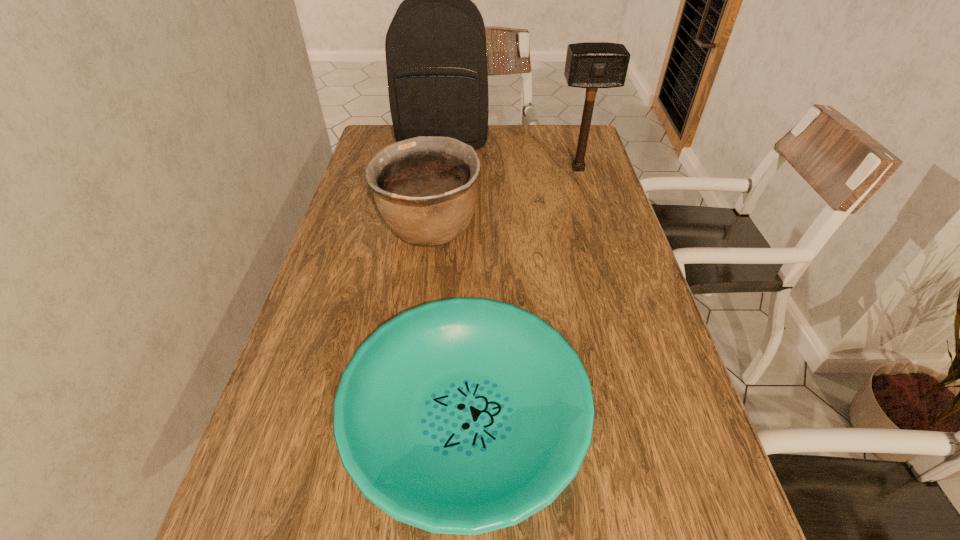
Where is `vacant space that is in between the rightmost object and the second shortest object`? vacant space that is in between the rightmost object and the second shortest object is located at coordinates 504,199.

Locate an element on the screen. This screenshot has width=960, height=540. empty space between the rightmost object and the second nearest object is located at coordinates (504, 199).

Identify the location of object that is the third closest to the second shortest object. (591, 65).

Identify which object is located as the third nearest to the second shortest object. Please provide its 2D coordinates. Your answer should be formatted as a tuple, i.e. [(x, y)], where the tuple contains the x and y coordinates of a point satisfying the conditions above.

[(591, 65)]

I want to click on free spot that satisfies the following two spatial constraints: 1. on the front-facing side of the farthest object; 2. on the right side of the second farthest object, so click(x=441, y=168).

I want to click on free region that satisfies the following two spatial constraints: 1. on the front-facing side of the third nearest object; 2. on the left side of the backpack, so click(x=441, y=168).